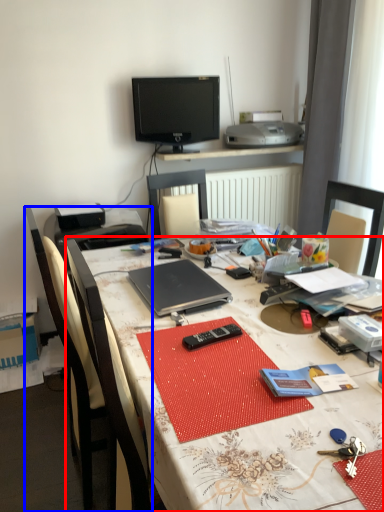
Question: Which point is closer to the camera, desk (highlighted by a red box) or chair (highlighted by a blue box)?

Choices:
 (A) desk
 (B) chair

Answer: (A)